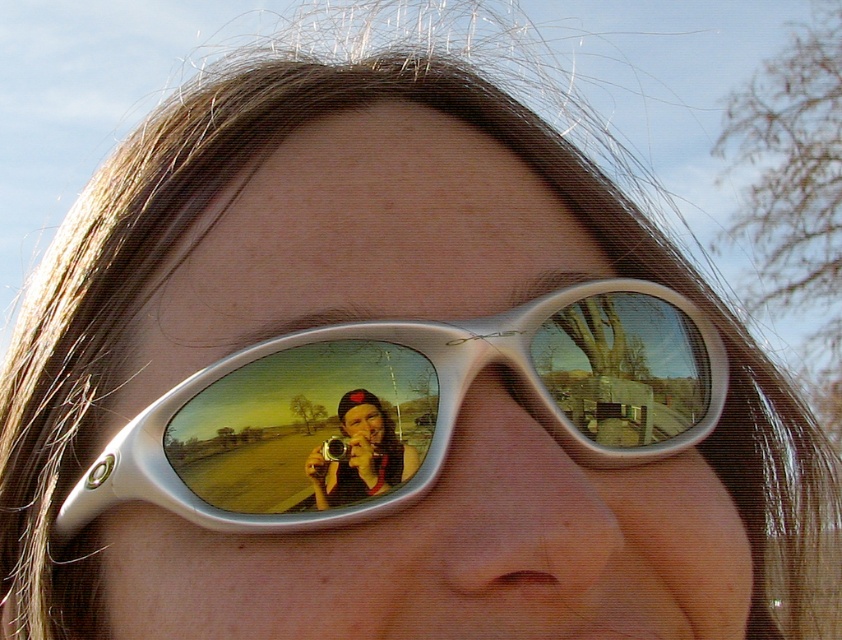
You are a photographer trying to adjust your setup. You have a white glossy sunglasses at center and a metallic silver camera at center in your view. Which object is located to the right of the other?

The white glossy sunglasses at center is positioned on the right side of metallic silver camera at center, so the sunglasses are to the right of the camera.

You are trying to take a photo of the person wearing the white glossy sunglasses at center. However, there is a metallic silver camera at center in the way. Can you see the sunglasses clearly through the camera?

The white glossy sunglasses at center is in front of the metallic silver camera at center, so you cannot see the sunglasses clearly through the camera because they are blocking the view.

You are a photographer standing 13.78 inches away from the white glossy sunglasses at center. You want to take a clear photo of the sunglasses without any reflections. Should you move closer or farther away?

The camera is already 13.78 inches away from the white glossy sunglasses at center, so moving closer would decrease the distance, potentially increasing reflections, while moving farther might reduce reflections but could affect clarity. However, since the optimal distance isn not specified, it is best to adjust the angle or lighting instead of distance.